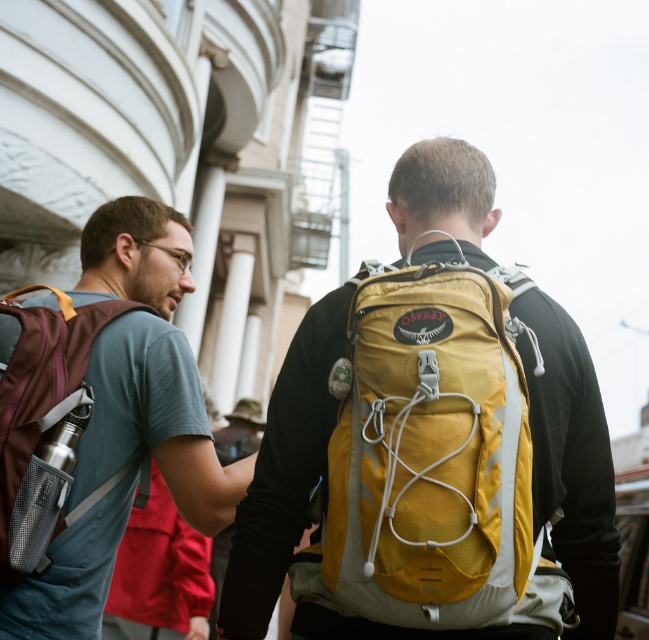
Looking at this image, is yellow fabric backpack at center positioned behind matte brown backpack at left?

No, yellow fabric backpack at center is closer to the viewer.

Who is positioned more to the right, yellow fabric backpack at center or matte brown backpack at left?

From the viewer's perspective, yellow fabric backpack at center appears more on the right side.

Is point (450, 308) farther from viewer compared to point (97, 289)?

No, (450, 308) is in front of (97, 289).

Identify the location of yellow fabric backpack at center. (432, 460).

Is yellow fabric backpack at center above matte purple backpack at left?

No.

Which is in front, point (528, 401) or point (36, 419)?

Positioned in front is point (528, 401).

Does point (349, 499) come closer to viewer compared to point (14, 362)?

Yes, point (349, 499) is closer to viewer.

Where is `yellow fabric backpack at center`? The height and width of the screenshot is (640, 649). yellow fabric backpack at center is located at coordinates (432, 460).

Does matte brown backpack at left have a lesser height compared to matte purple backpack at left?

No.

Is point (8, 595) positioned after point (5, 385)?

Yes, it is.

Which is in front, point (199, 408) or point (14, 444)?

Positioned in front is point (14, 444).

This screenshot has width=649, height=640. I want to click on matte brown backpack at left, so click(154, 420).